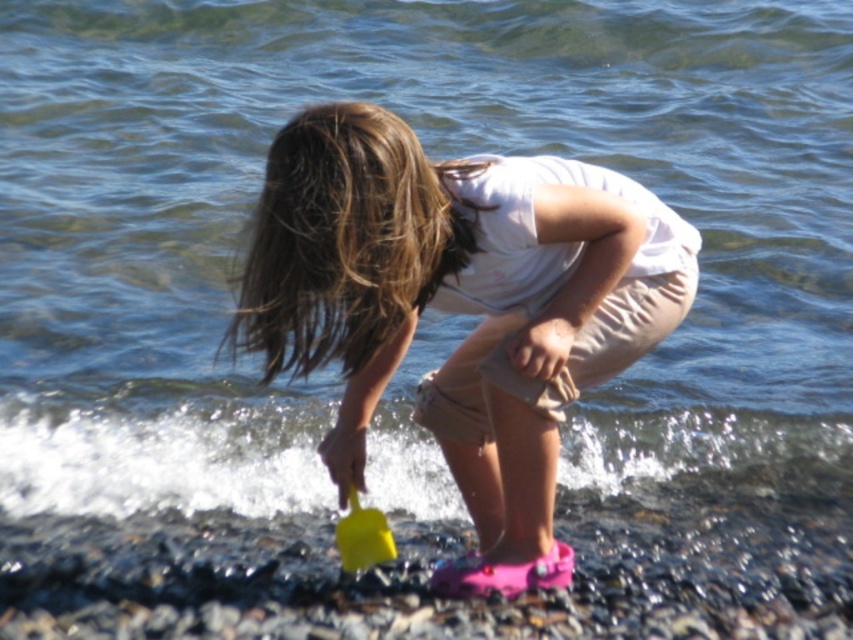
You are a photographer trying to capture the girl and her belongings in the image. You need to ensure that both the white cotton shirt at center and the yellow plastic shovel at lower center are visible in the frame. Based on their positions, which object should you focus on first to ensure both are in the shot?

The white cotton shirt at center is located above the yellow plastic shovel at lower center, so focusing on the white cotton shirt at center first will ensure the lower positioned shovel is also in the frame.

You are a photographer trying to capture the girl and her shovel in a single shot. Since the white cotton shirt at center and the yellow plastic shovel at lower center are both in the frame, can you focus on both objects at the same time?

The white cotton shirt at center is in front of the yellow plastic shovel at lower center, so focusing on both might be challenging as they are at different distances from the camera.

You are standing at the edge of the water and want to reach a seashell located at point (437, 278). If you can walk 3 meters before getting tired, will you be able to reach it?

The distance of point (437, 278) from viewer is 3.49 meters, so you cannot reach it before getting tired since it is further than 3 meters.